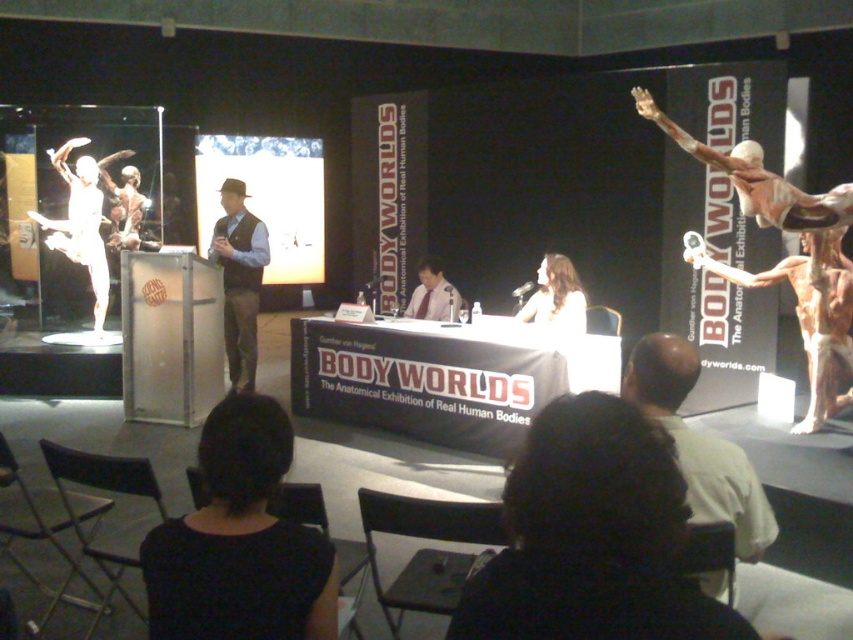
Question: Which point is closer to the camera taking this photo?

Choices:
 (A) (235, 564)
 (B) (556, 301)
 (C) (711, 500)

Answer: (A)

Question: Based on their relative distances, which object is nearer to the matte brown vest at center?

Choices:
 (A) black fabric at lower center
 (B) smooth white shirt at center
 (C) dark brown hair at lower center
 (D) light brown leather jacket at lower right

Answer: (B)

Question: Estimate the real-world distances between objects in this image. Which object is closer to the pink fabric tie at center?

Choices:
 (A) smooth white shirt at center
 (B) dark brown hair at lower center
 (C) light brown leather jacket at lower right
 (D) matte brown vest at center

Answer: (A)

Question: Does black fabric at lower center appear under smooth white shirt at center?

Choices:
 (A) no
 (B) yes

Answer: (B)

Question: Is light brown leather jacket at lower right thinner than matte brown vest at center?

Choices:
 (A) yes
 (B) no

Answer: (A)

Question: Is dark brown hair at lower center to the left of black fabric at lower center from the viewer's perspective?

Choices:
 (A) no
 (B) yes

Answer: (A)